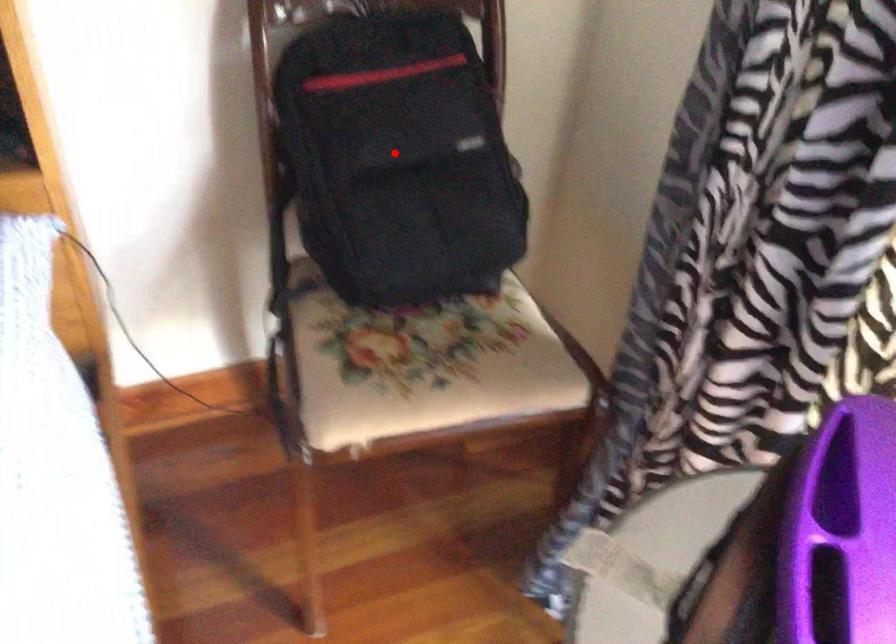
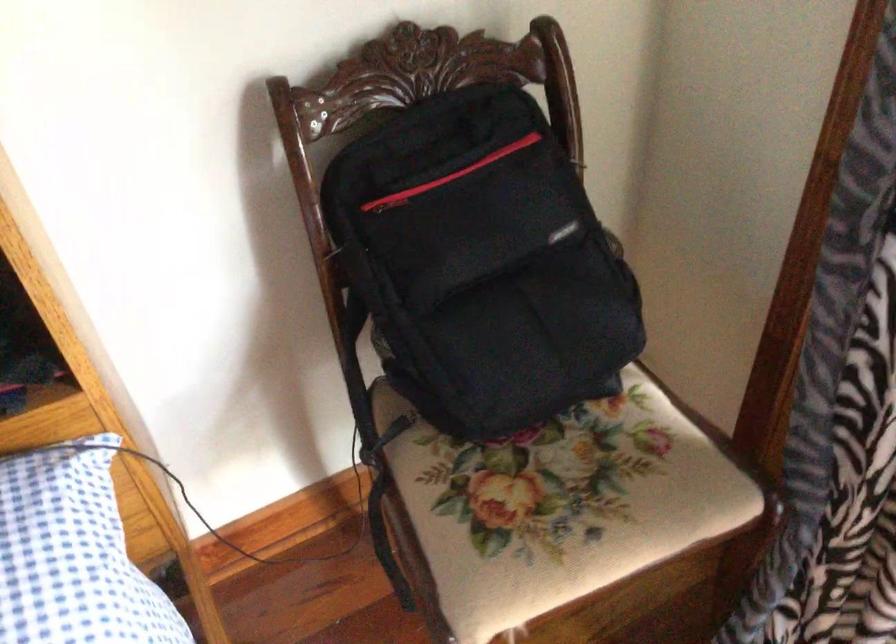
Question: I am providing you with two images of the same scene from different viewpoints. A red point is shown in image1. For the corresponding object point in image2, is it positioned nearer or farther from the camera?

Choices:
 (A) Nearer
 (B) Farther

Answer: (A)